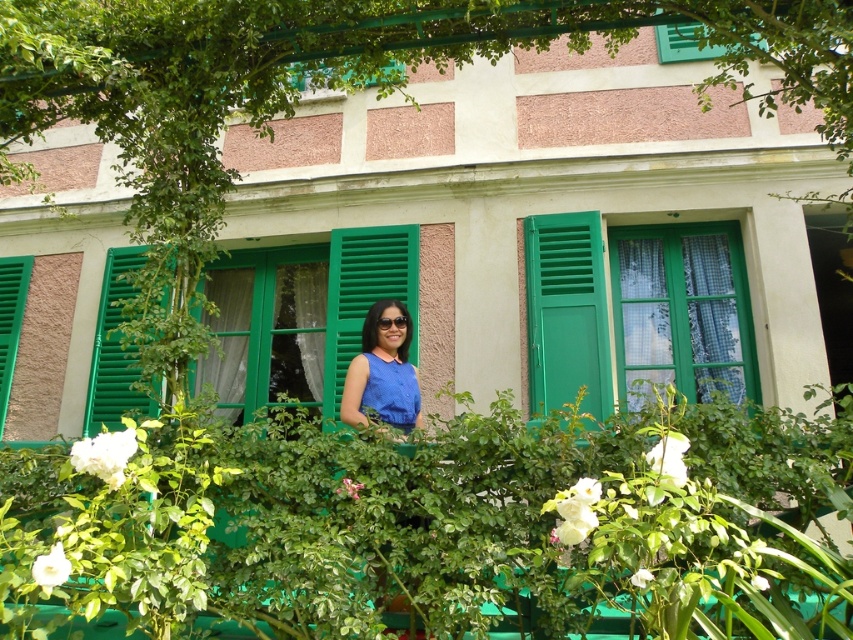
You are a window cleaner standing in front of the two story building. You need to clean both the blue fabric at center and the green matte shutter at left. Which object requires you to cover a larger area?

The green matte shutter at left requires covering a larger area since the blue fabric at center occupies less space than it.

You are standing in front of the two story building and want to locate the green matte window at center. According to the coordinates provided, where exactly is it positioned?

The green matte window at center is positioned at coordinates point (682, 310).

You are a delivery person standing at the entrance of the two story building. You need to deliver a package to the green wooden window at center. The package requires a 6 meter ladder to reach. Do you think the ladder will be sufficient?

The distance between you and the green wooden window at center is 5.90 meters, so the 6 meter ladder will be sufficient to reach the green wooden window at center.